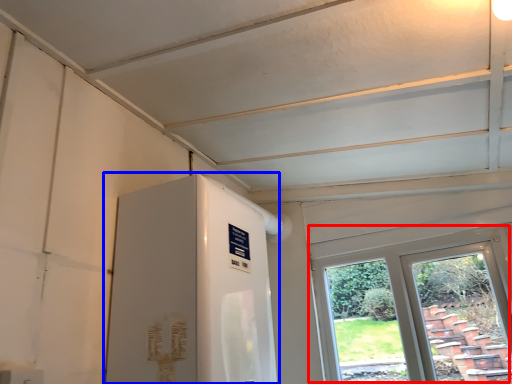
Question: Among these objects, which one is farthest to the camera, window (highlighted by a red box) or water heater (highlighted by a blue box)?

Choices:
 (A) window
 (B) water heater

Answer: (A)